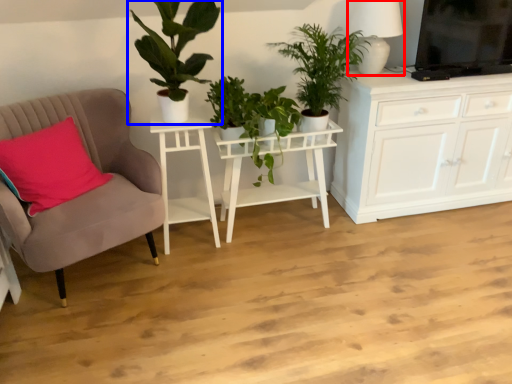
Question: Which object is closer to the camera taking this photo, lamp (highlighted by a red box) or houseplant (highlighted by a blue box)?

Choices:
 (A) lamp
 (B) houseplant

Answer: (B)